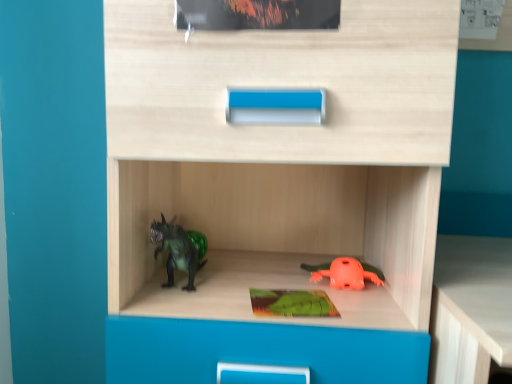
Question: Is green matte paperback book at center at the left side of green matte dinosaur at left, acting as the first toy starting from the left?

Choices:
 (A) no
 (B) yes

Answer: (A)

Question: From the image's perspective, is green matte paperback book at center under green matte dinosaur at left, positioned as the second toy in right-to-left order?

Choices:
 (A) yes
 (B) no

Answer: (A)

Question: Considering the relative sizes of green matte paperback book at center and green matte dinosaur at left, positioned as the second toy in right-to-left order, in the image provided, is green matte paperback book at center bigger than green matte dinosaur at left, positioned as the second toy in right-to-left order,?

Choices:
 (A) no
 (B) yes

Answer: (A)

Question: Is green matte paperback book at center placed right next to green matte dinosaur at left, acting as the first toy starting from the left?

Choices:
 (A) yes
 (B) no

Answer: (B)

Question: Is green matte paperback book at center taller than green matte dinosaur at left, acting as the first toy starting from the left?

Choices:
 (A) yes
 (B) no

Answer: (B)

Question: Considering the positions of green matte dinosaur at left, positioned as the second toy in right-to-left order, and orange matte frog at lower center, placed as the 2th toy when sorted from left to right, in the image, is green matte dinosaur at left, positioned as the second toy in right-to-left order, bigger or smaller than orange matte frog at lower center, placed as the 2th toy when sorted from left to right,?

Choices:
 (A) big
 (B) small

Answer: (A)

Question: From a real-world perspective, is green matte dinosaur at left, positioned as the second toy in right-to-left order, above or below orange matte frog at lower center, placed as the first toy when sorted from right to left?

Choices:
 (A) below
 (B) above

Answer: (B)

Question: From the image's perspective, is green matte dinosaur at left, acting as the first toy starting from the left, located above or below orange matte frog at lower center, placed as the first toy when sorted from right to left?

Choices:
 (A) above
 (B) below

Answer: (A)

Question: Based on their positions, is green matte dinosaur at left, positioned as the second toy in right-to-left order, located to the left or right of orange matte frog at lower center, placed as the first toy when sorted from right to left?

Choices:
 (A) right
 (B) left

Answer: (B)

Question: Does point (256, 294) appear closer or farther from the camera than point (163, 223)?

Choices:
 (A) farther
 (B) closer

Answer: (A)

Question: Do you think green matte paperback book at center is within green matte dinosaur at left, positioned as the second toy in right-to-left order, or outside of it?

Choices:
 (A) outside
 (B) inside

Answer: (A)

Question: Considering their positions, is green matte paperback book at center located in front of or behind green matte dinosaur at left, acting as the first toy starting from the left?

Choices:
 (A) front
 (B) behind

Answer: (A)

Question: Is green matte paperback book at center wider or thinner than green matte dinosaur at left, positioned as the second toy in right-to-left order?

Choices:
 (A) thin
 (B) wide

Answer: (A)

Question: Is orange matte frog at lower center, placed as the first toy when sorted from right to left, wider or thinner than green matte dinosaur at left, positioned as the second toy in right-to-left order?

Choices:
 (A) wide
 (B) thin

Answer: (B)

Question: Based on their sizes in the image, would you say orange matte frog at lower center, placed as the 2th toy when sorted from left to right, is bigger or smaller than green matte dinosaur at left, acting as the first toy starting from the left?

Choices:
 (A) big
 (B) small

Answer: (B)